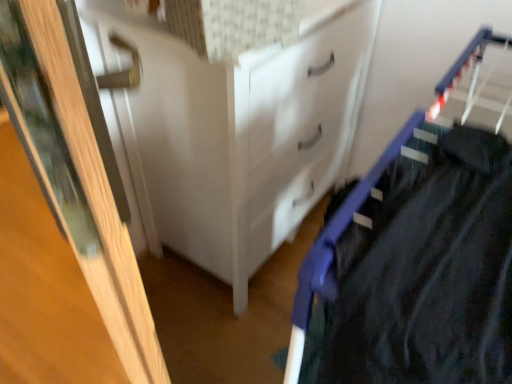
Question: Does point (19, 36) appear closer or farther from the camera than point (234, 279)?

Choices:
 (A) closer
 (B) farther

Answer: (A)

Question: In the image, is wooden door at left on the left side or the right side of white glossy chest of drawers at center?

Choices:
 (A) left
 (B) right

Answer: (A)

Question: Is wooden door at left bigger or smaller than white glossy chest of drawers at center?

Choices:
 (A) small
 (B) big

Answer: (A)

Question: From the image's perspective, is white glossy chest of drawers at center above or below wooden door at left?

Choices:
 (A) above
 (B) below

Answer: (A)

Question: Considering the positions of white glossy chest of drawers at center and wooden door at left in the image, is white glossy chest of drawers at center taller or shorter than wooden door at left?

Choices:
 (A) short
 (B) tall

Answer: (A)

Question: Looking at the image, does white glossy chest of drawers at center seem bigger or smaller compared to wooden door at left?

Choices:
 (A) small
 (B) big

Answer: (B)

Question: Is white glossy chest of drawers at center in front of or behind wooden door at left in the image?

Choices:
 (A) behind
 (B) front

Answer: (A)